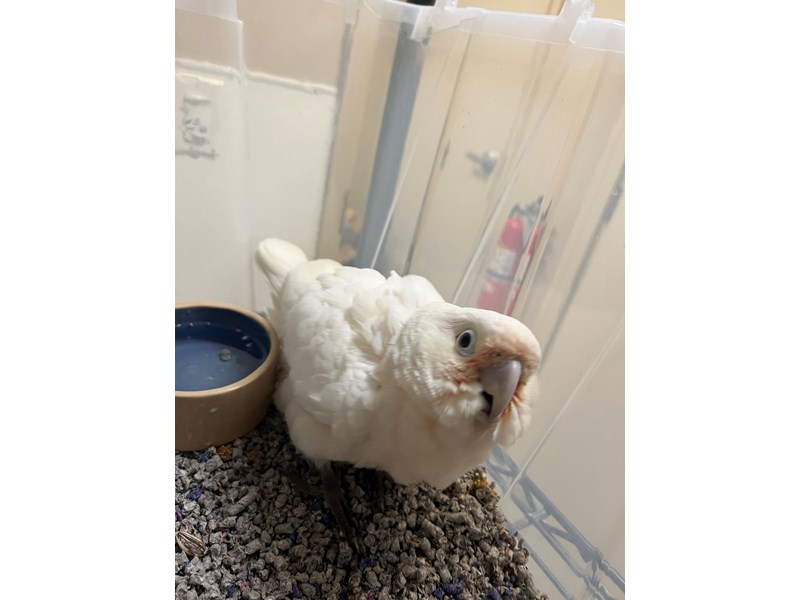
This screenshot has height=600, width=800. Find the location of `cage bedding`. cage bedding is located at coordinates (318, 543).